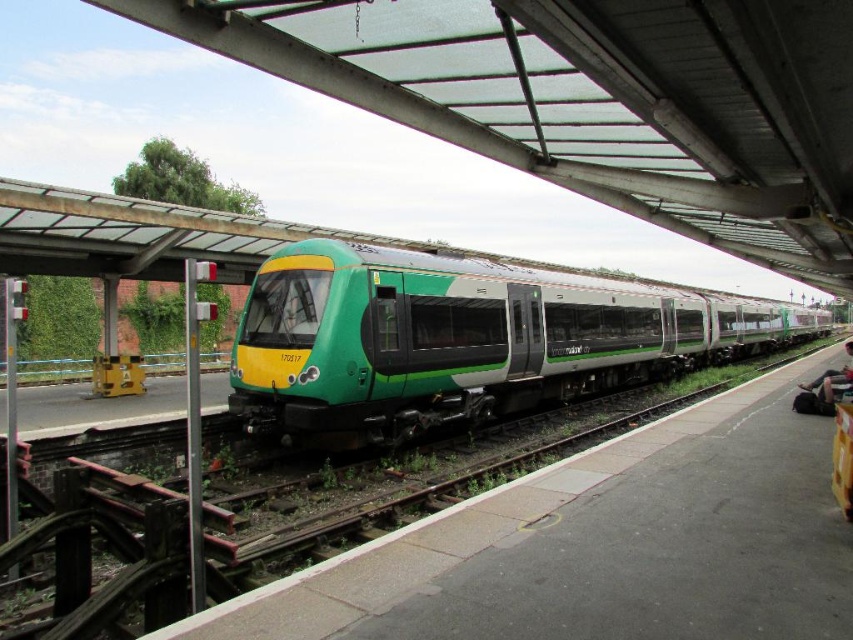
You are a passenger waiting at the train station platform. You notice the green matte train at center and the dark gray fabric bag at lower right. Which object is taller?

The green matte train at center is taller than the dark gray fabric bag at lower right.

You are standing at the train station platform. There is a point marked at coordinates (461, 339). What object is located at that point?

The point at coordinates (461, 339) indicates the green matte train at center.